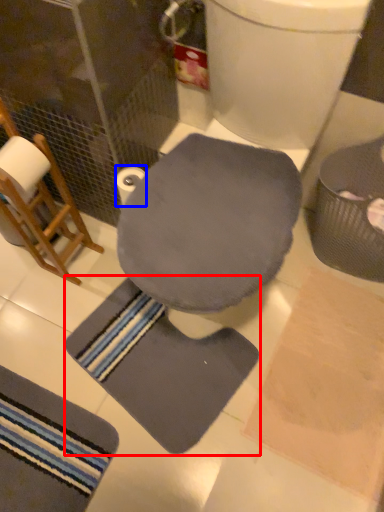
Question: Among these objects, which one is farthest to the camera, bath mat (highlighted by a red box) or toilet paper (highlighted by a blue box)?

Choices:
 (A) bath mat
 (B) toilet paper

Answer: (A)